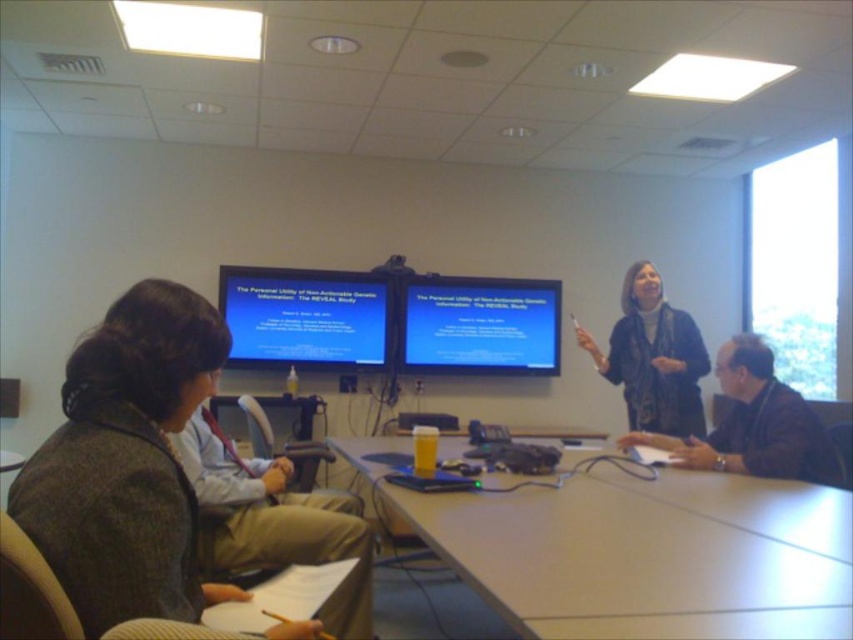
You are in a conference room and need to place a new table that is 1.5 meters long. Where should you place it so it doesn not block the brown leather jacket at right?

The brown leather jacket at right is located at point (753, 424). To avoid blocking it, place the new table away from that coordinate, ensuring there is enough space between the table and the jacket.

You are sitting at the smooth light brown table at center and want to hand a document to the person wearing the brown leather jacket at right. Can you reach them without leaving your seat?

The smooth light brown table at center is in front of the brown leather jacket at right, so you can reach them without leaving your seat.

You are attending a virtual meeting and need to focus on the person wearing the brown leather jacket at right. From your perspective, will the matte black scarf at upper right block your view of them?

The brown leather jacket at right is in front of the matte black scarf at upper right, so the scarf will not block your view of the jacket wearer.